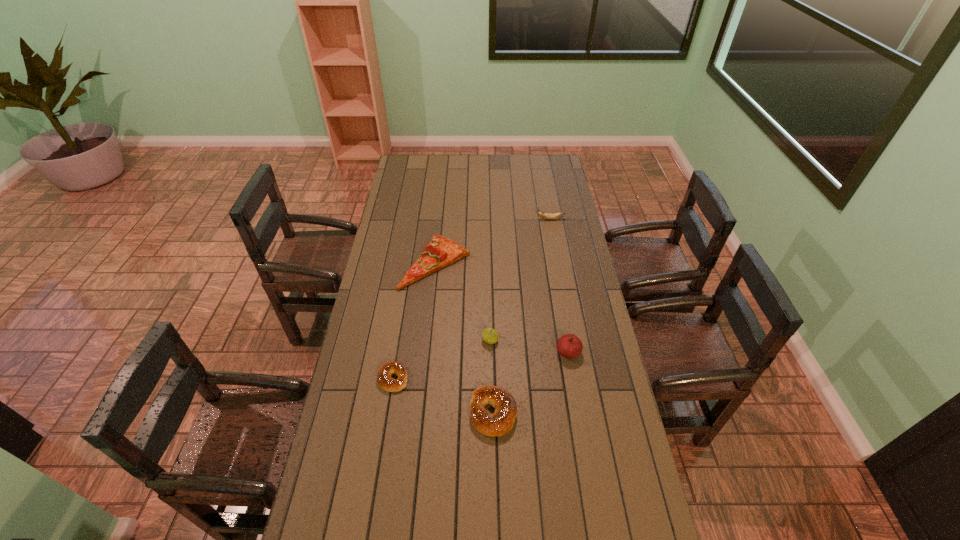
In order to click on blank region between the third shortest object and the farthest object in this screenshot , I will do `click(522, 316)`.

I want to click on vacant area that lies between the tomato and the pear, so click(x=529, y=346).

Image resolution: width=960 pixels, height=540 pixels. I want to click on vacant space that's between the left bagel and the taller bagel, so click(443, 395).

The width and height of the screenshot is (960, 540). I want to click on vacant region between the left bagel and the pizza, so click(x=415, y=320).

What are the coordinates of `vacant space that is in between the farthest object and the tomato` in the screenshot? It's located at (560, 286).

Point out which object is positioned as the third nearest to the tomato. Please provide its 2D coordinates. Your answer should be formatted as a tuple, i.e. [(x, y)], where the tuple contains the x and y coordinates of a point satisfying the conditions above.

[(440, 252)]

Where is `object that is the fifth closest to the farthest object`? object that is the fifth closest to the farthest object is located at coordinates (384, 378).

Where is `free spot that satisfies the following two spatial constraints: 1. on the peel of the farthest object; 2. on the front side of the tomato`? The width and height of the screenshot is (960, 540). free spot that satisfies the following two spatial constraints: 1. on the peel of the farthest object; 2. on the front side of the tomato is located at coordinates (575, 352).

Locate an element on the screen. free space that satisfies the following two spatial constraints: 1. on the back side of the left bagel; 2. on the right side of the tomato is located at coordinates (396, 352).

Identify the location of vacant region that satisfies the following two spatial constraints: 1. on the front side of the third shortest object; 2. on the left side of the pear. Image resolution: width=960 pixels, height=540 pixels. (492, 413).